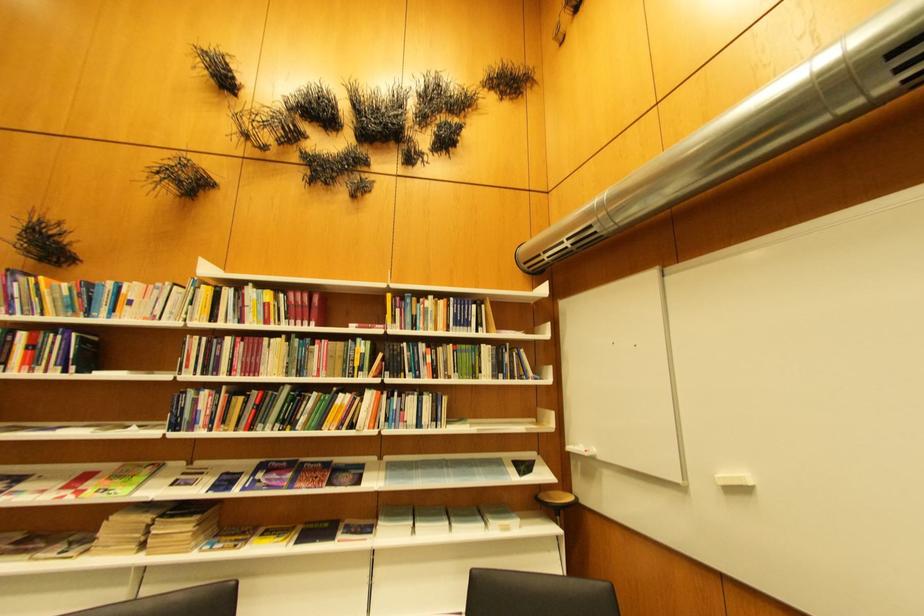
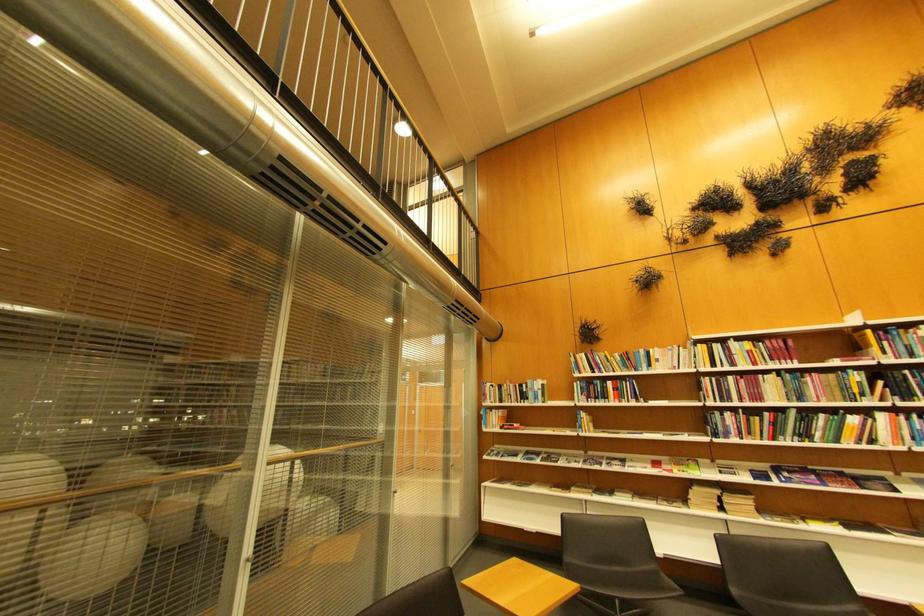
The point at (x=238, y=341) is marked in the first image. Where is the corresponding point in the second image?

(740, 379)